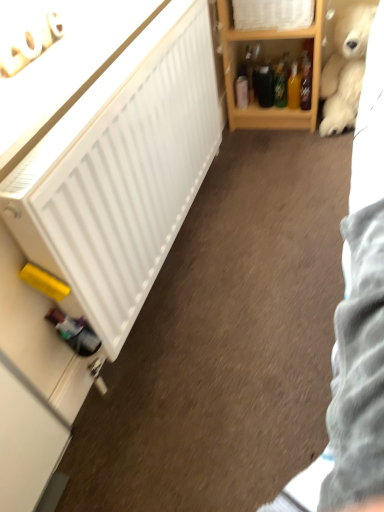
At what (x,y) coordinates should I click in order to perform the action: click on fluffy white teddy bear at upper right. Please return your answer as a coordinate pair (x, y). Looking at the image, I should click on (345, 69).

Where is `white wood cabinet at upper center`? white wood cabinet at upper center is located at coordinates (270, 19).

The image size is (384, 512). Find the location of `wooden shelf at upper right`. wooden shelf at upper right is located at coordinates [x=270, y=59].

Locate an element on the screen. bottle below the wooden shelf at upper right (from the image's perspective) is located at coordinates (306, 84).

Considering the positions of objects translucent plastic bottle at upper right and wooden shelf at upper right in the image provided, who is more to the right, translucent plastic bottle at upper right or wooden shelf at upper right?

translucent plastic bottle at upper right.

Looking at the image, does translucent plastic bottle at upper right seem bigger or smaller compared to wooden shelf at upper right?

Clearly, translucent plastic bottle at upper right is smaller in size than wooden shelf at upper right.

Would you say translucent plastic bottle at upper right contains wooden shelf at upper right?

No, wooden shelf at upper right is not inside translucent plastic bottle at upper right.

From the image's perspective, would you say translucent plastic bottle at upper right is shown under fluffy white teddy bear at upper right?

Correct, translucent plastic bottle at upper right appears lower than fluffy white teddy bear at upper right in the image.

From a real-world perspective, is translucent plastic bottle at upper right physically located above or below fluffy white teddy bear at upper right?

From a real-world perspective, translucent plastic bottle at upper right is physically below fluffy white teddy bear at upper right.

Is translucent plastic bottle at upper right positioned beyond the bounds of fluffy white teddy bear at upper right?

translucent plastic bottle at upper right lies outside fluffy white teddy bear at upper right's area.

Which of these two, translucent plastic bottle at upper right or fluffy white teddy bear at upper right, is wider?

fluffy white teddy bear at upper right.

How much distance is there between fluffy white teddy bear at upper right and white wood cabinet at upper center?

fluffy white teddy bear at upper right and white wood cabinet at upper center are 11.31 inches apart from each other.

Can you confirm if fluffy white teddy bear at upper right is smaller than white wood cabinet at upper center?

Actually, fluffy white teddy bear at upper right might be larger than white wood cabinet at upper center.

From their relative heights in the image, would you say fluffy white teddy bear at upper right is taller or shorter than white wood cabinet at upper center?

fluffy white teddy bear at upper right is taller than white wood cabinet at upper center.

At what (x,y) coordinates should I click in order to perform the action: click on cabinet above the fluffy white teddy bear at upper right (from the image's perspective). Please return your answer as a coordinate pair (x, y). The height and width of the screenshot is (512, 384). Looking at the image, I should click on (270, 19).

Does wooden shelf at upper right have a greater width compared to fluffy white teddy bear at upper right?

No.

From the image's perspective, between wooden shelf at upper right and fluffy white teddy bear at upper right, which one is located above?

wooden shelf at upper right is shown above in the image.

Between wooden shelf at upper right and fluffy white teddy bear at upper right, which one has larger size?

Bigger between the two is wooden shelf at upper right.

Is fluffy white teddy bear at upper right a part of wooden shelf at upper right?

No, fluffy white teddy bear at upper right is not surrounded by wooden shelf at upper right.

Between point (283, 10) and point (338, 99), which one is positioned behind?

The point (338, 99) is behind.

Considering the relative sizes of white wood cabinet at upper center and fluffy white teddy bear at upper right in the image provided, is white wood cabinet at upper center wider than fluffy white teddy bear at upper right?

No.

Which object is further away from the camera, white wood cabinet at upper center or fluffy white teddy bear at upper right?

white wood cabinet at upper center is behind.

Is white wood cabinet at upper center not close to fluffy white teddy bear at upper right?

They are positioned close to each other.

Which object is closer to the camera, fluffy white teddy bear at upper right or wooden shelf at upper right?

wooden shelf at upper right is more forward.

Is point (353, 97) positioned before point (234, 34)?

No, (353, 97) is behind (234, 34).

Would you say fluffy white teddy bear at upper right is to the left or to the right of wooden shelf at upper right in the picture?

fluffy white teddy bear at upper right is to the right of wooden shelf at upper right.

From the image's perspective, which one is positioned higher, fluffy white teddy bear at upper right or wooden shelf at upper right?

wooden shelf at upper right appears higher in the image.

Is fluffy white teddy bear at upper right completely or partially outside of translucent plastic bottle at upper right?

Yes, fluffy white teddy bear at upper right is outside of translucent plastic bottle at upper right.

Looking at the image, does fluffy white teddy bear at upper right seem bigger or smaller compared to translucent plastic bottle at upper right?

Considering their sizes, fluffy white teddy bear at upper right takes up more space than translucent plastic bottle at upper right.

From a real-world perspective, between fluffy white teddy bear at upper right and translucent plastic bottle at upper right, who is vertically lower?

translucent plastic bottle at upper right is physically lower.

Where is `bottle below the wooden shelf at upper right (from the image's perspective)`? Image resolution: width=384 pixels, height=512 pixels. bottle below the wooden shelf at upper right (from the image's perspective) is located at coordinates (306, 84).

The image size is (384, 512). What are the coordinates of `bottle on the left of fluffy white teddy bear at upper right` in the screenshot? It's located at (306, 84).

Which object lies nearer to the anchor point white wood cabinet at upper center, fluffy white teddy bear at upper right or wooden shelf at upper right?

wooden shelf at upper right is positioned closer to the anchor white wood cabinet at upper center.

Looking at the image, which one is located closer to wooden shelf at upper right, white wood cabinet at upper center or fluffy white teddy bear at upper right?

The object closer to wooden shelf at upper right is white wood cabinet at upper center.

When comparing their distances from white wood cabinet at upper center, does translucent plastic bottle at upper right or wooden shelf at upper right seem closer?

Among the two, wooden shelf at upper right is located nearer to white wood cabinet at upper center.

From the image, which object appears to be farther from fluffy white teddy bear at upper right, translucent plastic bottle at upper right or wooden shelf at upper right?

Based on the image, wooden shelf at upper right appears to be further to fluffy white teddy bear at upper right.

Looking at the image, which one is located further to fluffy white teddy bear at upper right, wooden shelf at upper right or translucent plastic bottle at upper right?

wooden shelf at upper right is positioned further to the anchor fluffy white teddy bear at upper right.

Looking at the image, which one is located closer to translucent plastic bottle at upper right, wooden shelf at upper right or fluffy white teddy bear at upper right?

fluffy white teddy bear at upper right is positioned closer to the anchor translucent plastic bottle at upper right.

Estimate the real-world distances between objects in this image. Which object is further from white wood cabinet at upper center, translucent plastic bottle at upper right or fluffy white teddy bear at upper right?

fluffy white teddy bear at upper right.

When comparing their distances from translucent plastic bottle at upper right, does white wood cabinet at upper center or fluffy white teddy bear at upper right seem closer?

fluffy white teddy bear at upper right is positioned closer to the anchor translucent plastic bottle at upper right.

I want to click on shelf that lies between white wood cabinet at upper center and translucent plastic bottle at upper right from top to bottom, so click(x=270, y=59).

Locate an element on the screen. The height and width of the screenshot is (512, 384). bottle between white wood cabinet at upper center and fluffy white teddy bear at upper right from left to right is located at coordinates [306, 84].

Locate an element on the screen. Image resolution: width=384 pixels, height=512 pixels. bottle situated between wooden shelf at upper right and fluffy white teddy bear at upper right from left to right is located at coordinates (306, 84).

At what (x,y) coordinates should I click in order to perform the action: click on shelf located between white wood cabinet at upper center and fluffy white teddy bear at upper right in the left-right direction. Please return your answer as a coordinate pair (x, y). The image size is (384, 512). Looking at the image, I should click on (270, 59).